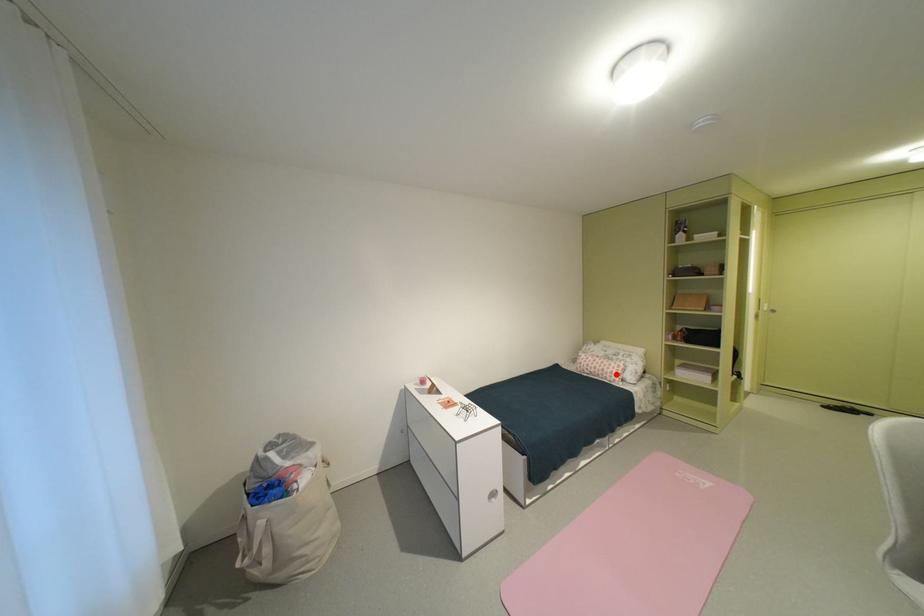
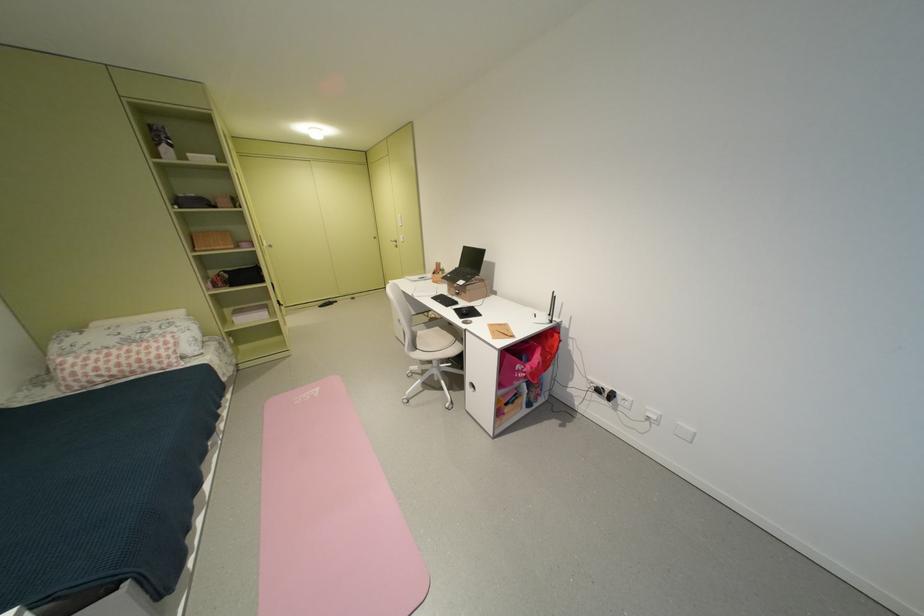
In the second image, find the point that corresponds to the highlighted location in the first image.

(159, 362)